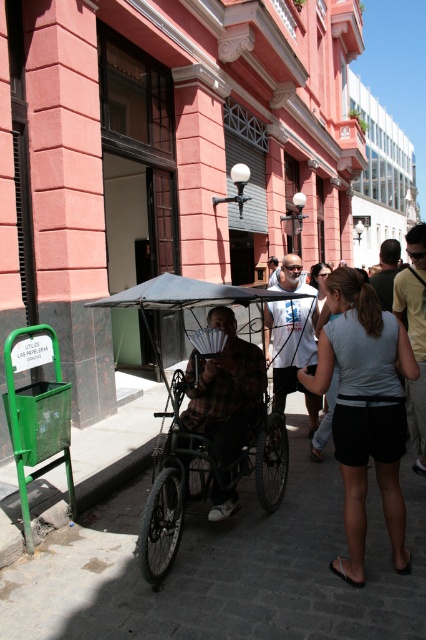
Who is positioned more to the left, light gray fabric shirt at center or plaid fabric cart at center?

plaid fabric cart at center

Who is more forward, (x=302, y=381) or (x=213, y=317)?

Positioned in front is point (x=302, y=381).

What do you see at coordinates (365, 410) in the screenshot?
I see `light gray fabric shirt at center` at bounding box center [365, 410].

Find the location of a particular element. light gray fabric shirt at center is located at coordinates (365, 410).

Based on the photo, is gray fabric coach at center in front of brown leather coach at center?

Yes, it is.

Which is in front, point (402, 291) or point (394, 252)?

Point (402, 291) is more forward.

Is point (423, 472) closer to camera compared to point (383, 252)?

Yes, point (423, 472) is closer to viewer.

Locate an element on the screen. This screenshot has height=640, width=426. gray fabric coach at center is located at coordinates (414, 337).

Is black matte wheelchair at center bigger than plaid fabric cart at center?

Yes, black matte wheelchair at center is bigger than plaid fabric cart at center.

Does black matte wheelchair at center have a smaller size compared to plaid fabric cart at center?

Incorrect, black matte wheelchair at center is not smaller in size than plaid fabric cart at center.

Locate an element on the screen. The width and height of the screenshot is (426, 640). black matte wheelchair at center is located at coordinates (204, 476).